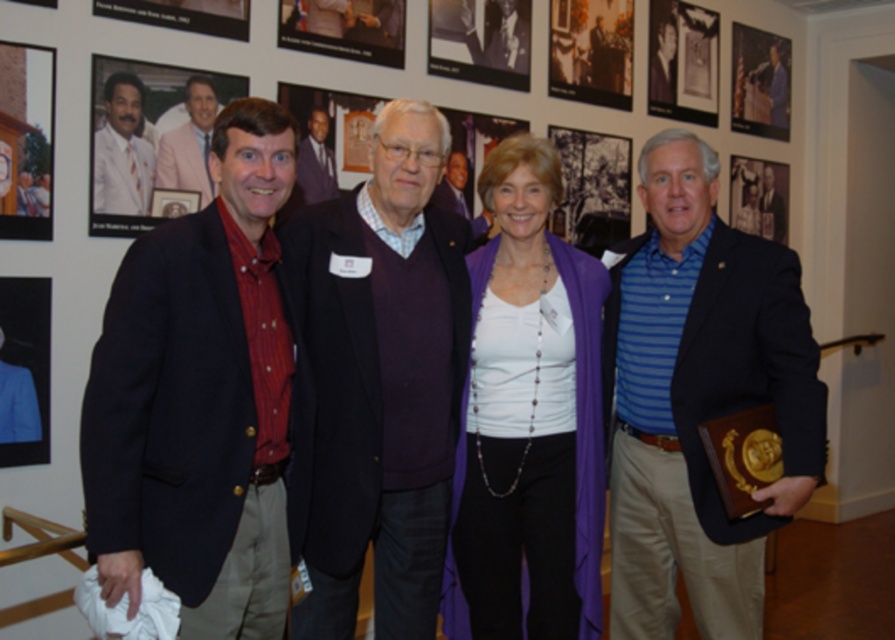
Which is more to the left, matte black blazer at left or purple fabric at center?

From the viewer's perspective, matte black blazer at left appears more on the left side.

Between point (243, 275) and point (450, 580), which one is positioned behind?

The point (450, 580) is behind.

Where is `matte black blazer at left`? Image resolution: width=895 pixels, height=640 pixels. matte black blazer at left is located at coordinates (202, 401).

Which is below, matte black blazer at left or wooden plaque at upper center?

matte black blazer at left is below.

From the picture: Does matte black blazer at left appear on the right side of wooden plaque at upper center?

No, matte black blazer at left is not to the right of wooden plaque at upper center.

Who is more forward, (195, 408) or (358, 20)?

Point (195, 408)

You are a GUI agent. You are given a task and a screenshot of the screen. Output one action in this format:
    pyautogui.click(x=<x>, y=<y>)
    Task: Click on the matte black blazer at left
    Image resolution: width=895 pixels, height=640 pixels.
    Given the screenshot: What is the action you would take?
    pyautogui.click(x=202, y=401)

Can you confirm if blue striped shirt at right is wider than matte black frame at left?

Yes, blue striped shirt at right is wider than matte black frame at left.

Who is more forward, (663, 376) or (99, 58)?

Point (663, 376)

Locate an element on the screen. blue striped shirt at right is located at coordinates (697, 397).